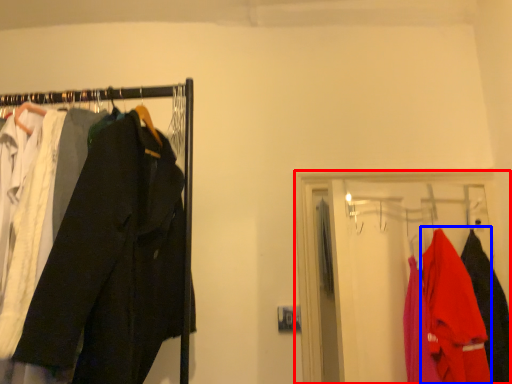
Question: Which of the following is the farthest to the observer, closet (highlighted by a red box) or clothing (highlighted by a blue box)?

Choices:
 (A) closet
 (B) clothing

Answer: (A)